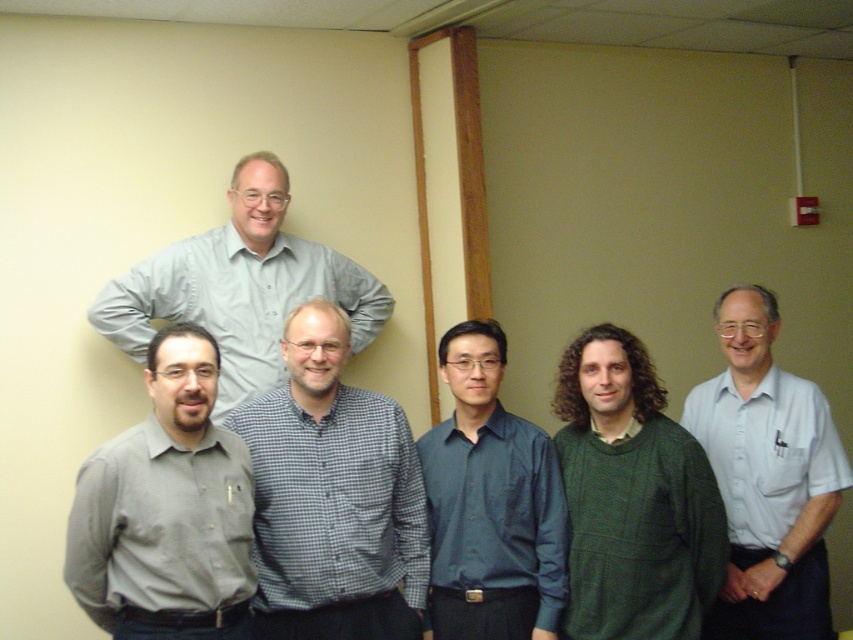
Question: Estimate the real-world distances between objects in this image. Which object is farther from the dark blue shirt at center?

Choices:
 (A) light gray shirt at right
 (B) gray checkered shirt at center
 (C) gray matte shirt at lower left

Answer: (C)

Question: Which object is farther from the camera taking this photo?

Choices:
 (A) light gray shirt at upper center
 (B) light gray shirt at right

Answer: (A)

Question: Does light gray shirt at right lie behind light gray shirt at upper center?

Choices:
 (A) yes
 (B) no

Answer: (B)

Question: From the image, what is the correct spatial relationship of gray checkered shirt at center in relation to dark blue shirt at center?

Choices:
 (A) above
 (B) below

Answer: (A)

Question: Can you confirm if gray checkered shirt at center is positioned below light gray shirt at upper center?

Choices:
 (A) no
 (B) yes

Answer: (B)

Question: Which of these objects is positioned farthest from the gray matte shirt at lower left?

Choices:
 (A) light gray shirt at right
 (B) gray checkered shirt at center

Answer: (A)